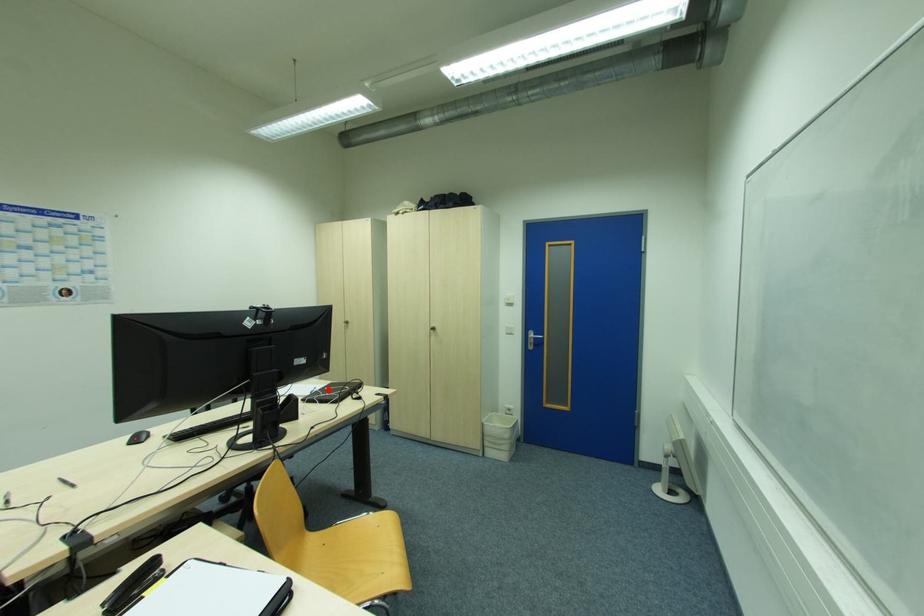
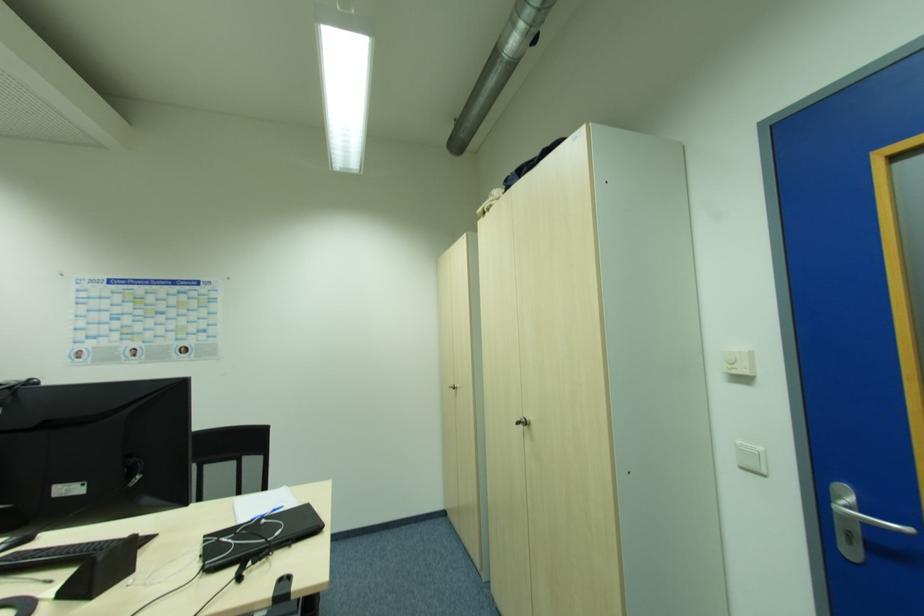
The point at the highlighted location is marked in the first image. Where is the corresponding point in the second image?

(265, 521)